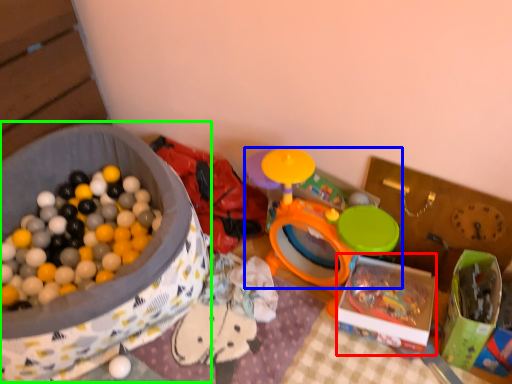
Question: Considering the real-world distances, which object is farthest from storage box (highlighted by a red box)? toy (highlighted by a blue box) or storage box (highlighted by a green box)?

Choices:
 (A) toy
 (B) storage box

Answer: (B)